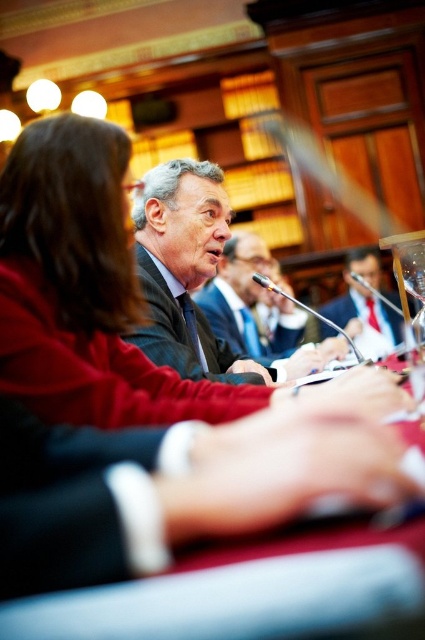
You are organizing a meeting and need to place a 2.5 feet wide laptop on the table. Given the smooth red table at center and dark gray suit at center, can the laptop fit on the table?

The smooth red table at center has a lesser width compared to dark gray suit at center, so the table is narrower than the suit. Since the laptop is 2.5 feet wide, it might not fit on the table if the table is narrower than the laptop. However, without knowing the exact dimensions of the table, it is impossible to determine if the laptop will fit.

Looking at this image, you are organizing a charity event and need to choose a suit for the host. The dark suit at center and the matte black suit at center are available. Which one is more suitable if you prefer a more compact size?

The dark suit at center is smaller than the matte black suit at center, so it is more suitable for a compact size preference.